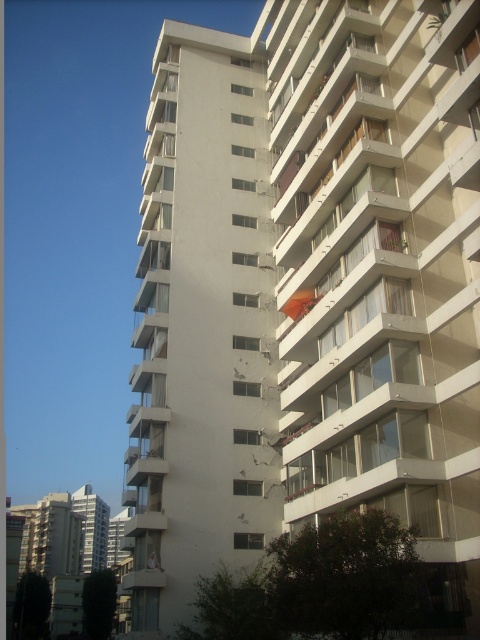
Between white glossy balcony at center and orange fabric umbrella at center, which one appears on the left side from the viewer's perspective?

From the viewer's perspective, orange fabric umbrella at center appears more on the left side.

The width and height of the screenshot is (480, 640). What do you see at coordinates (380, 260) in the screenshot?
I see `white glossy balcony at center` at bounding box center [380, 260].

Locate an element on the screen. This screenshot has height=640, width=480. white glossy balcony at center is located at coordinates (380, 260).